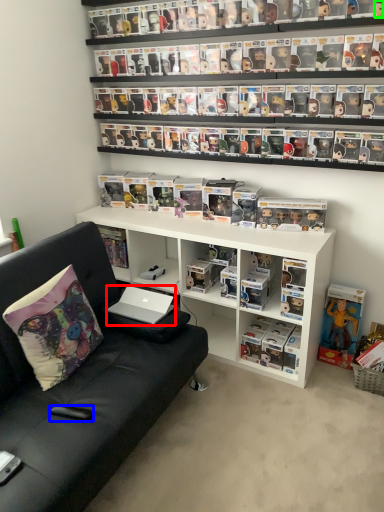
Question: Based on their relative distances, which object is farther from laptop (highlighted by a red box)? Choose from remote control (highlighted by a blue box) and toy (highlighted by a green box).

Choices:
 (A) remote control
 (B) toy

Answer: (B)